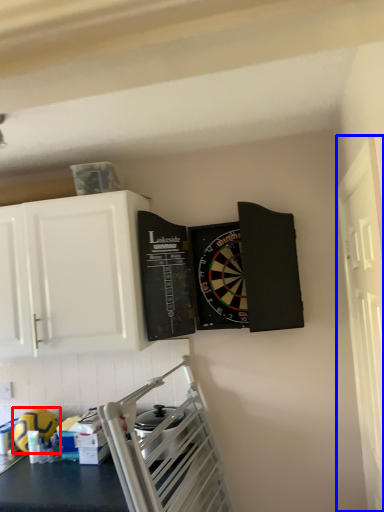
Question: Which point is closer to the camera, appliance (highlighted by a red box) or window (highlighted by a blue box)?

Choices:
 (A) appliance
 (B) window

Answer: (B)